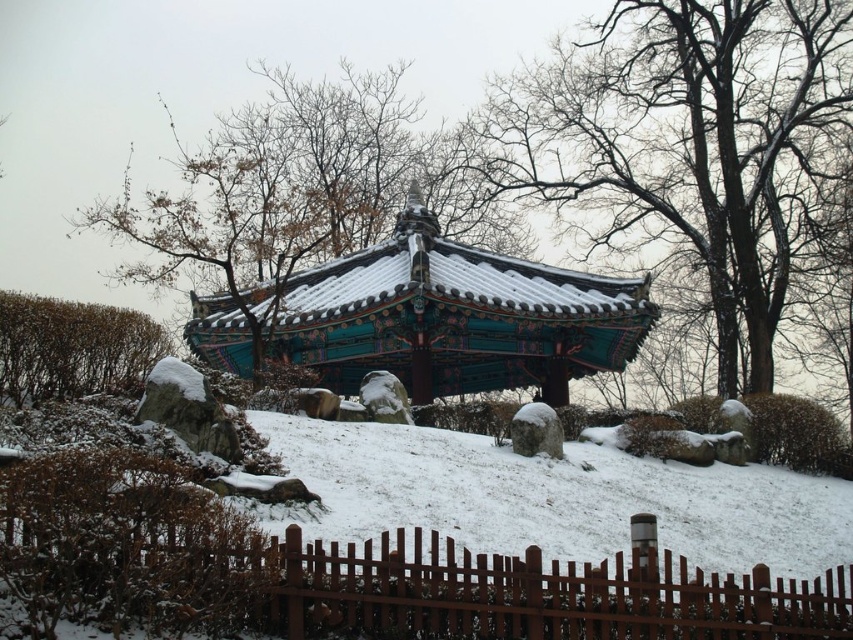
You are standing in front of the traditional Korean pavilion surrounded by snow. You notice two points marked in the scene. The first point is at coordinates point (x=775, y=156) and the second is at point (x=808, y=628). From your perspective, which point is closer to the pavilion?

Point (x=775, y=156) is behind point (x=808, y=628), so the point closer to the pavilion is point (x=808, y=628).

You are standing in front of the brown wooden fence at lower center and want to see the green wooden pavilion at center. Can you see the entire pavilion from your current position?

The green wooden pavilion at center might be wider than brown wooden fence at lower center, so it is possible that parts of the pavilion extend beyond the fence and are visible from your position.

Consider the image. You are standing in front of the traditional Korean pavilion and want to know if the green wooden pavilion at center is wider than the green leafy bush at left. Can you determine this based on the scene?

The green wooden pavilion at center is wider than the green leafy bush at left according to the scene description.